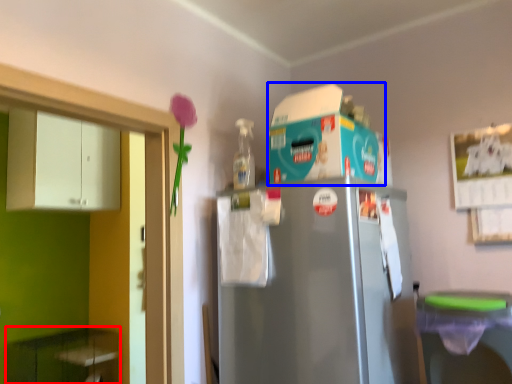
Question: Which of the following is the farthest to the observer, cabinetry (highlighted by a red box) or appliance (highlighted by a blue box)?

Choices:
 (A) cabinetry
 (B) appliance

Answer: (A)